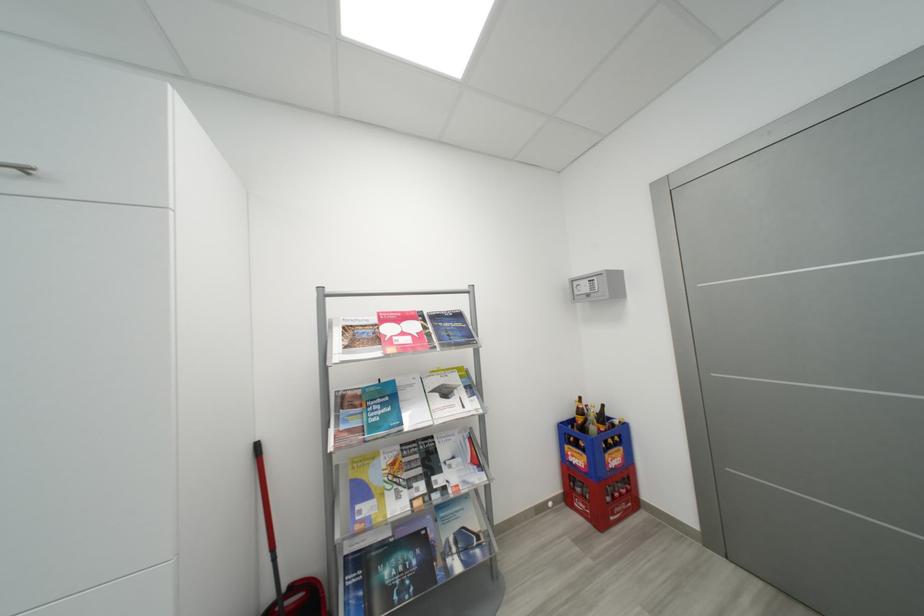
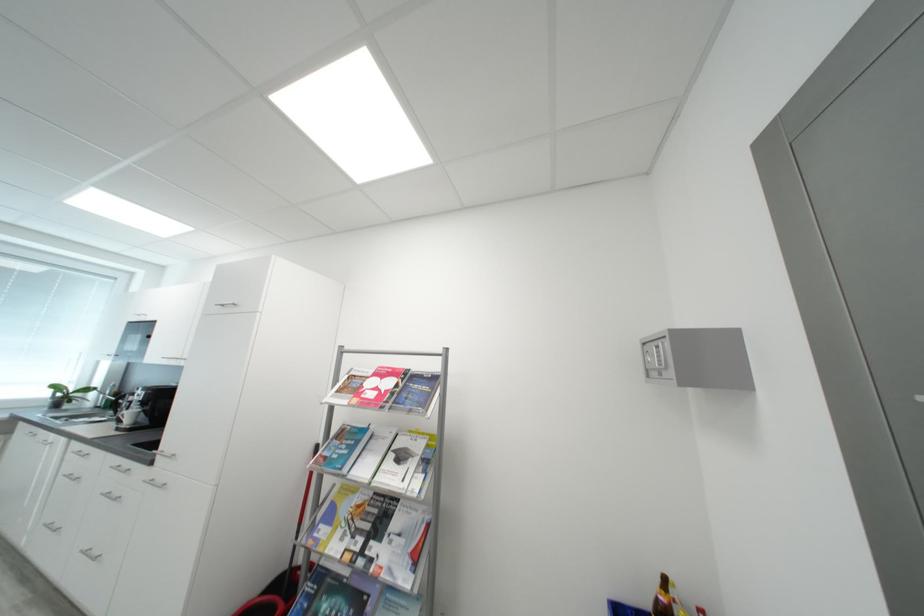
Find the pixel in the second image that matches (x=590, y=290) in the first image.

(660, 361)